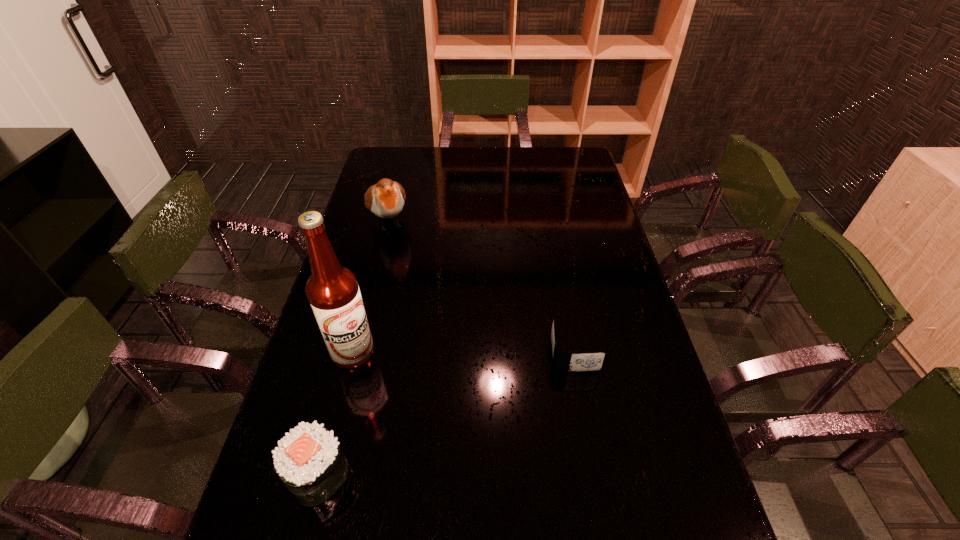
The width and height of the screenshot is (960, 540). Identify the location of object that is at the near left corner. (309, 460).

You are a GUI agent. You are given a task and a screenshot of the screen. Output one action in this format:
    pyautogui.click(x=<x>, y=<y>)
    Task: Click on the vacant space at the far edge of the desktop
    This screenshot has height=540, width=960.
    Given the screenshot: What is the action you would take?
    pyautogui.click(x=478, y=173)

The width and height of the screenshot is (960, 540). Find the location of `vacant space at the left edge of the desktop`. vacant space at the left edge of the desktop is located at coordinates (347, 408).

You are a GUI agent. You are given a task and a screenshot of the screen. Output one action in this format:
    pyautogui.click(x=<x>, y=<y>)
    Task: Click on the free space at the right edge of the desktop
    This screenshot has height=540, width=960.
    Given the screenshot: What is the action you would take?
    pyautogui.click(x=597, y=293)

Image resolution: width=960 pixels, height=540 pixels. What are the coordinates of `vacant space at the far left corner` in the screenshot? It's located at (393, 160).

You are a GUI agent. You are given a task and a screenshot of the screen. Output one action in this format:
    pyautogui.click(x=<x>, y=<y>)
    Task: Click on the vacant region at the far right corner of the desktop
    This screenshot has height=540, width=960.
    Given the screenshot: What is the action you would take?
    pyautogui.click(x=578, y=167)

Find the location of a particular element. The height and width of the screenshot is (540, 960). vacant region at the near right corner is located at coordinates (653, 532).

You are a GUI agent. You are given a task and a screenshot of the screen. Output one action in this format:
    pyautogui.click(x=<x>, y=<y>)
    Task: Click on the free point between the sushi and the wallet
    This screenshot has height=540, width=960.
    Given the screenshot: What is the action you would take?
    pyautogui.click(x=446, y=414)

Locate an element on the screen. free spot between the second tallest object and the alcohol is located at coordinates (371, 286).

Where is `vacant space that's between the tallest object and the nearest object`? vacant space that's between the tallest object and the nearest object is located at coordinates (335, 413).